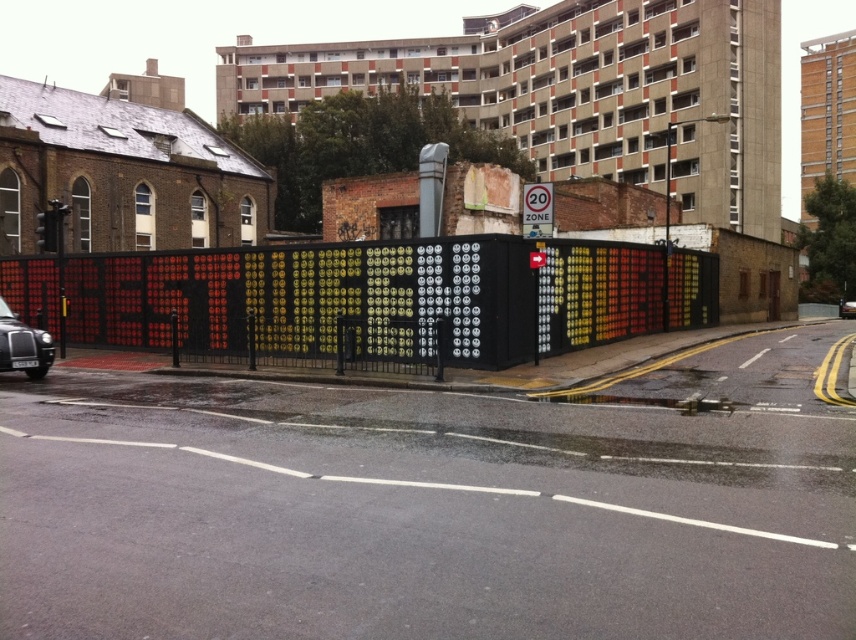
You are standing in front of the colorful smiley face wall and want to take a photo of both the metallic black fence at center and the black metallic car at center. Based on their positions, which one should you adjust your camera angle to include first?

The metallic black fence at center is to the left of the black metallic car at center, so you should adjust your camera angle to include the metallic black fence at center first as it is positioned to the left.

In the scene shown: You are standing in front of the colorful wall with smiley faces and want to take a photo of both the metallic black fence at center and the black metallic car at center. Since both are in the same scene, which one should you focus on first to ensure both are in focus?

You should focus on the metallic black fence at center first because it is closer to you than the black metallic car at center, so adjusting focus starting from the closer object ensures both will be in focus.

You are standing in front of the urban street scene described. You want to know if the metallic black fence at center is larger in size compared to the black metallic car at left. Based on the scene, can you determine which one is bigger?

The metallic black fence at center is bigger than the black metallic car at left, so yes, the fence is larger in size.